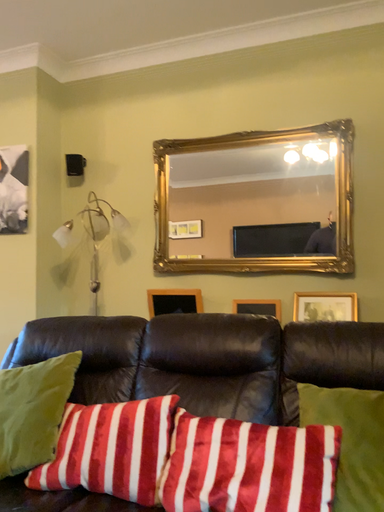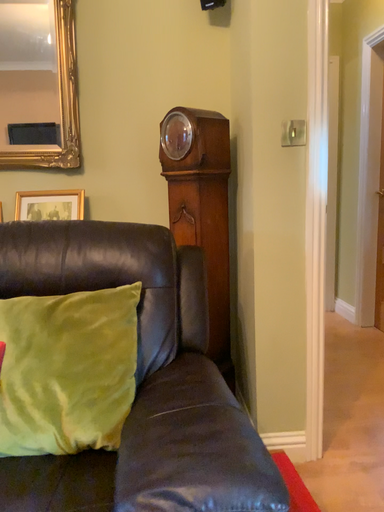
Question: How did the camera likely rotate when shooting the video?

Choices:
 (A) rotated downward
 (B) rotated upward

Answer: (A)